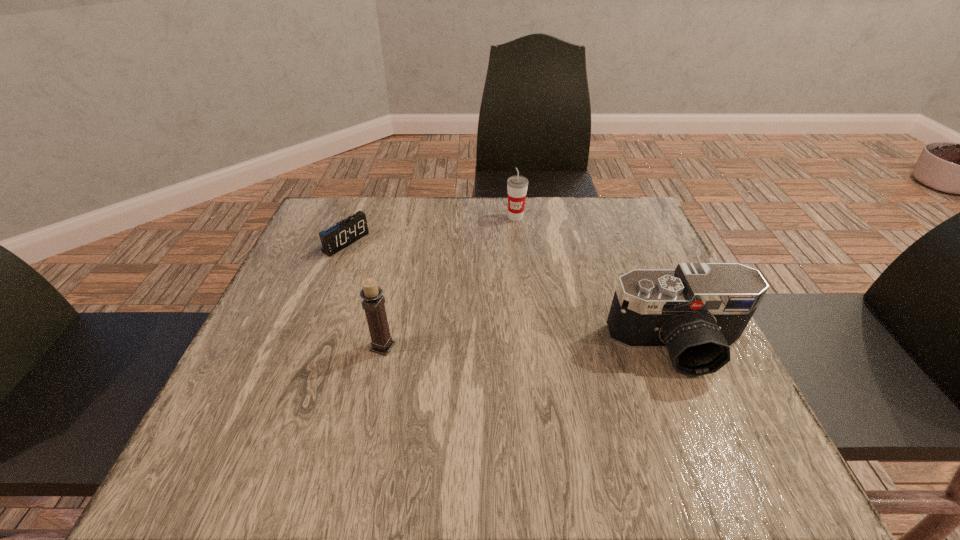
Locate an element on the screen. The width and height of the screenshot is (960, 540). vacant area that lies between the rightmost object and the candle holder is located at coordinates (530, 347).

Locate an element on the screen. The image size is (960, 540). free space between the second farthest object and the rightmost object is located at coordinates (512, 295).

This screenshot has height=540, width=960. I want to click on free point between the leftmost object and the camera, so click(512, 295).

You are a GUI agent. You are given a task and a screenshot of the screen. Output one action in this format:
    pyautogui.click(x=<x>, y=<y>)
    Task: Click on the free space between the rightmost object and the second object from left to right
    This screenshot has height=540, width=960.
    Given the screenshot: What is the action you would take?
    pyautogui.click(x=530, y=347)

In order to click on free area in between the second object from left to right and the farthest object in this screenshot , I will do `click(449, 282)`.

Where is `the second closest object relative to the leftmost object`? the second closest object relative to the leftmost object is located at coordinates (517, 186).

Choose which object is the third nearest neighbor to the cup. Please provide its 2D coordinates. Your answer should be formatted as a tuple, i.e. [(x, y)], where the tuple contains the x and y coordinates of a point satisfying the conditions above.

[(374, 302)]

In order to click on free space that satisfies the following two spatial constraints: 1. on the back side of the cup; 2. on the right side of the second object from left to right in this screenshot , I will do point(411,217).

In order to click on vacant space that satisfies the following two spatial constraints: 1. on the back side of the shortest object; 2. on the right side of the second object from right to left in this screenshot , I will do `click(356, 217)`.